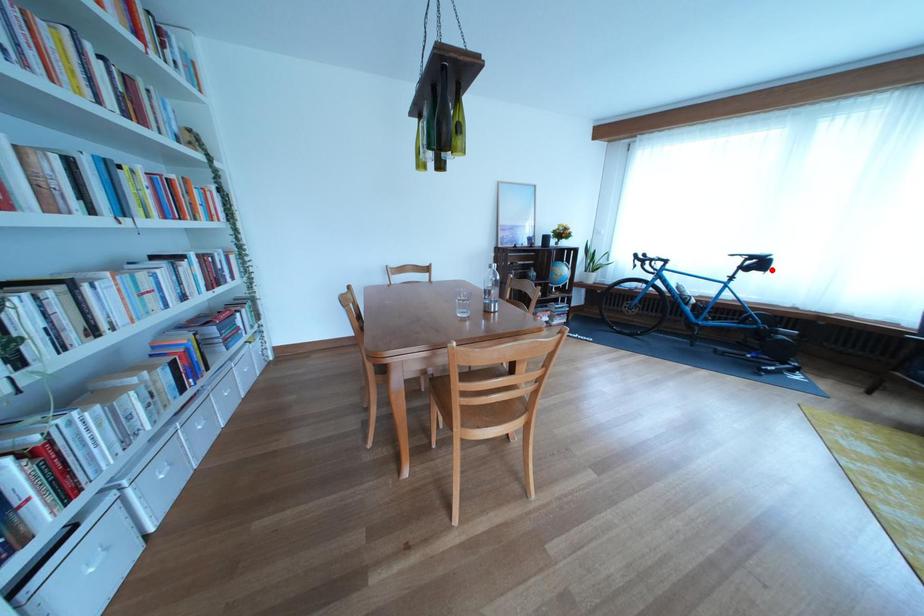
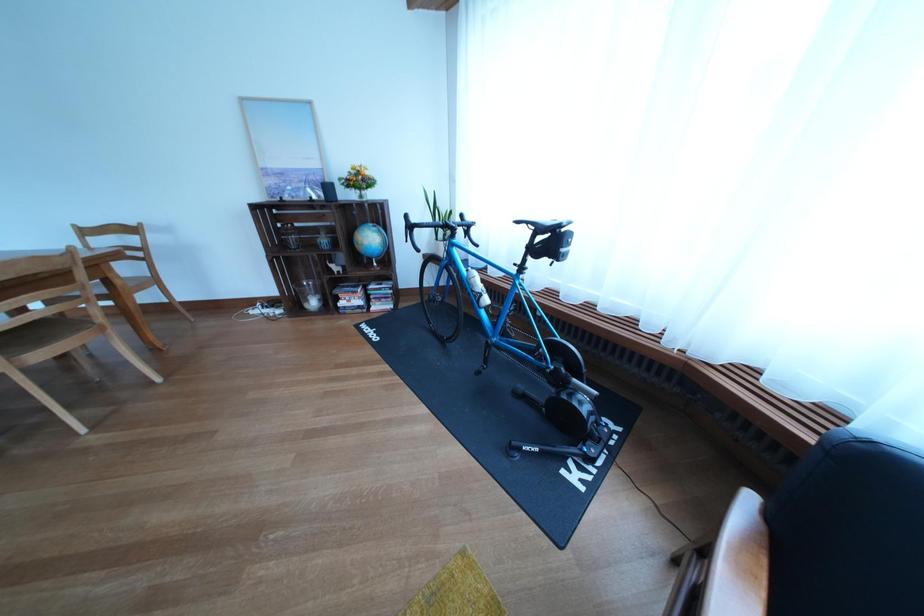
Where in the second image is the point corresponding to the highlighted location from the first image?

(563, 248)